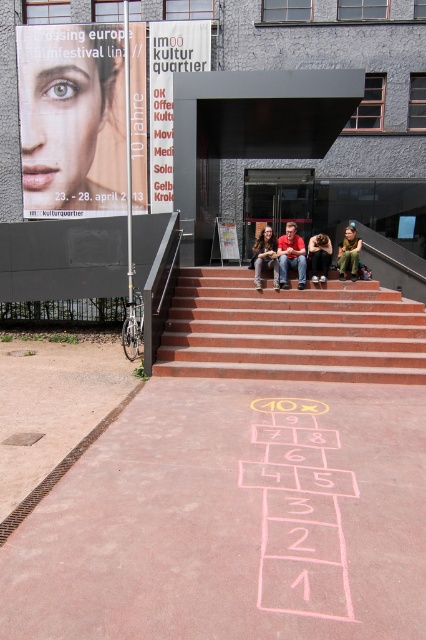
Question: Which object is positioned closest to the dark brown leather jacket at center?

Choices:
 (A) jeans at center
 (B) brown hair at center
 (C) white paper poster at center
 (D) red brick stairs at center

Answer: (A)

Question: Is white paper sign at upper center positioned at the back of white paper poster at center?

Choices:
 (A) yes
 (B) no

Answer: (A)

Question: Is red brick stairs at center wider than brown hair at center?

Choices:
 (A) no
 (B) yes

Answer: (B)

Question: Among these points, which one is nearest to the camera?

Choices:
 (A) (299, 435)
 (B) (271, 262)

Answer: (A)

Question: Can you confirm if chalk hopscotch at center is positioned to the left of white paper poster at center?

Choices:
 (A) no
 (B) yes

Answer: (A)

Question: Which of the following is the closest to the observer?

Choices:
 (A) (402, 340)
 (B) (77, 52)
 (C) (354, 241)

Answer: (A)